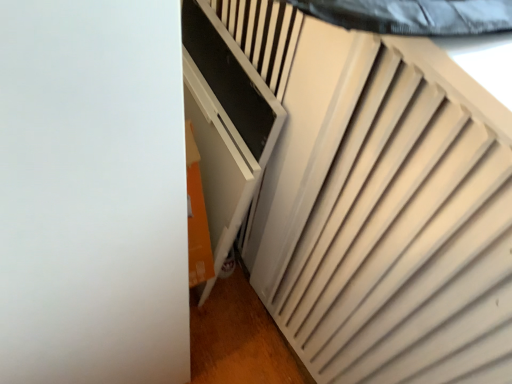
What do you see at coordinates (376, 202) in the screenshot? I see `white matte radiator at center` at bounding box center [376, 202].

Where is `white matte radiator at center`? The image size is (512, 384). white matte radiator at center is located at coordinates (376, 202).

You are a GUI agent. You are given a task and a screenshot of the screen. Output one action in this format:
    pyautogui.click(x=<x>, y=<y>)
    Task: Click on the white matte radiator at center
    This screenshot has height=384, width=512.
    Given the screenshot: What is the action you would take?
    pyautogui.click(x=376, y=202)